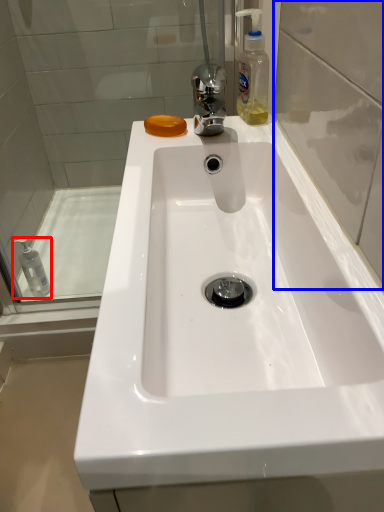
Question: Which of the following is the closest to the observer, mouthwash (highlighted by a red box) or glass door (highlighted by a blue box)?

Choices:
 (A) mouthwash
 (B) glass door

Answer: (B)